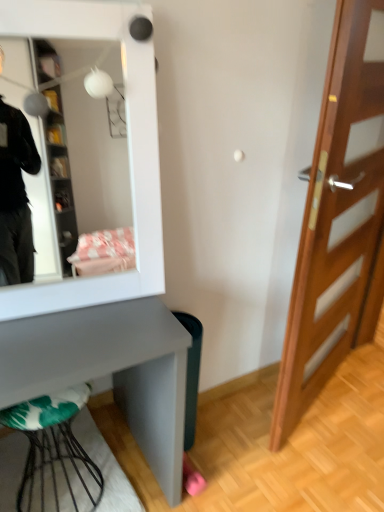
This screenshot has height=512, width=384. Find the location of `free spot in front of wooden door at right`. free spot in front of wooden door at right is located at coordinates (331, 458).